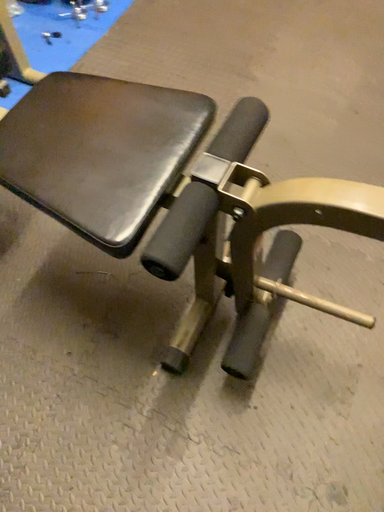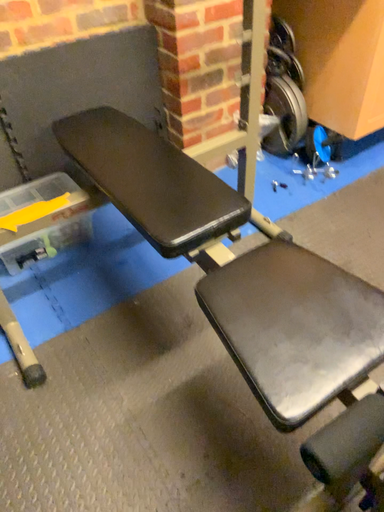
Question: How did the camera likely rotate when shooting the video?

Choices:
 (A) rotated upward
 (B) rotated downward

Answer: (A)